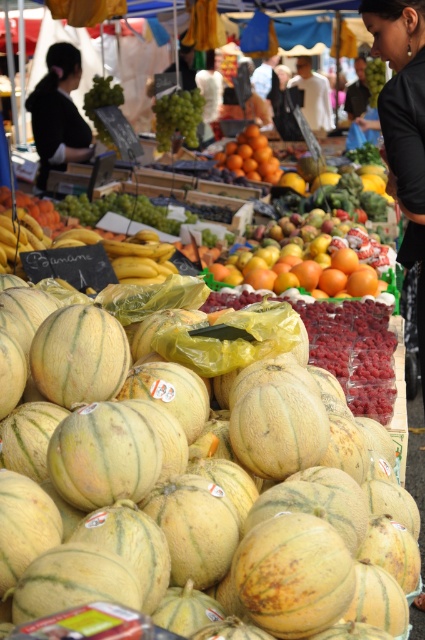
From the picture: You are a customer standing at the market stall and want to pick up the green striped cantaloupe at center and the green matte grapes at upper center. Which one is closer to you?

The green striped cantaloupe at center is closer to you than the green matte grapes at upper center because it is only 6.67 meters away from the grapes, meaning the cantaloupe is nearer.

You are a customer at the market and want to know which object is taller between the black fabric at upper right and the green matte grapes at upper center. Can you tell me?

The black fabric at upper right has a greater height compared to the green matte grapes at upper center, so the black fabric at upper right is taller.

You are standing in the market and want to find the green striped cantaloupe at center. Based on its 2D location coordinates, can you tell me whether it is positioned more to the left or right side of the image?

The green striped cantaloupe at center has coordinates at point (201, 497). Since the x coordinate is 0.778, which is closer to 1, it is positioned more to the right side of the image.